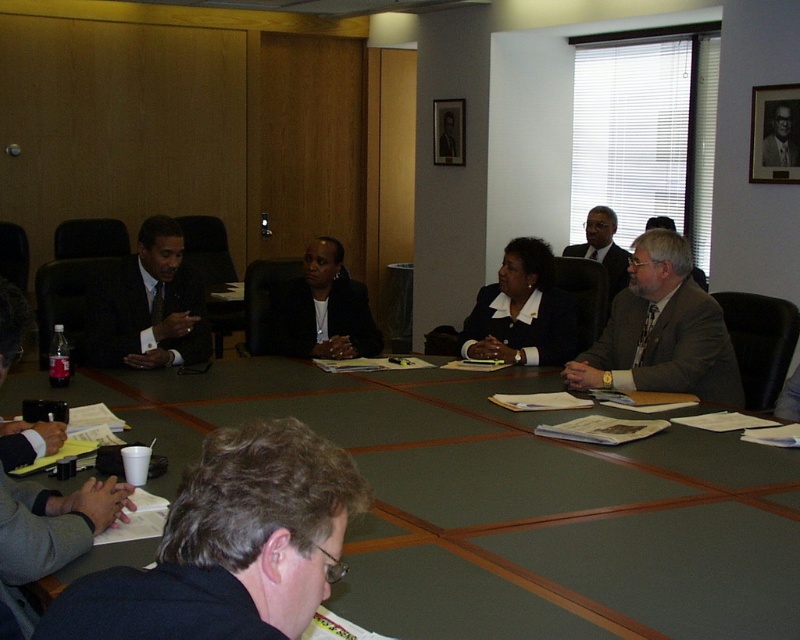
Does dark gray fabric shirt at lower left have a lesser width compared to matte black blazer at center?

Yes, dark gray fabric shirt at lower left is thinner than matte black blazer at center.

The image size is (800, 640). Describe the element at coordinates (154, 605) in the screenshot. I see `dark gray fabric shirt at lower left` at that location.

Where is `dark gray fabric shirt at lower left`? This screenshot has height=640, width=800. dark gray fabric shirt at lower left is located at coordinates (154, 605).

Which of these two, matte gray suit at right or dark gray suit at upper right, stands shorter?

Standing shorter between the two is dark gray suit at upper right.

Does point (678, 346) come farther from viewer compared to point (788, 147)?

No, (678, 346) is closer to viewer.

Is point (728, 381) closer to viewer compared to point (776, 145)?

Yes, point (728, 381) is closer to viewer.

Find the location of a particular element. The image size is (800, 640). matte gray suit at right is located at coordinates (664, 348).

Can you confirm if dark gray suit at center is positioned below dark gray suit at upper right?

Yes, dark gray suit at center is below dark gray suit at upper right.

Measure the distance between point [604,260] and camera.

Point [604,260] and camera are 18.06 feet apart from each other.

Between point (586, 253) and point (790, 152), which one is positioned in front?

Point (790, 152) is in front.

Image resolution: width=800 pixels, height=640 pixels. I want to click on dark gray suit at center, so pos(613,266).